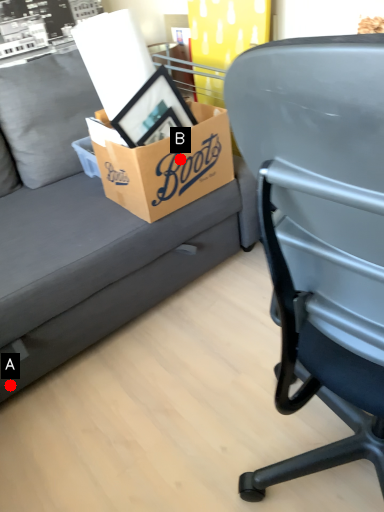
Question: Two points are circled on the image, labeled by A and B beside each circle. Which of the following is the closest to the observer?

Choices:
 (A) A is closer
 (B) B is closer

Answer: (A)